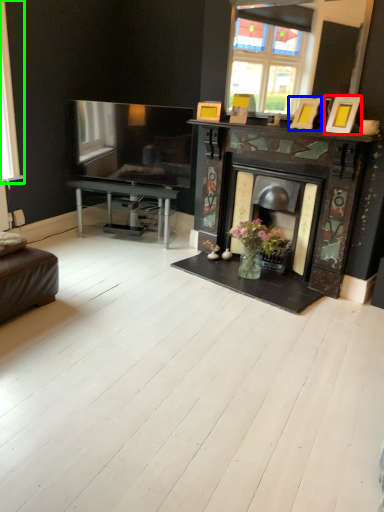
Question: Which object is the closest to the picture frame (highlighted by a red box)? Choose among these: picture frame (highlighted by a blue box) or window (highlighted by a green box).

Choices:
 (A) picture frame
 (B) window

Answer: (A)